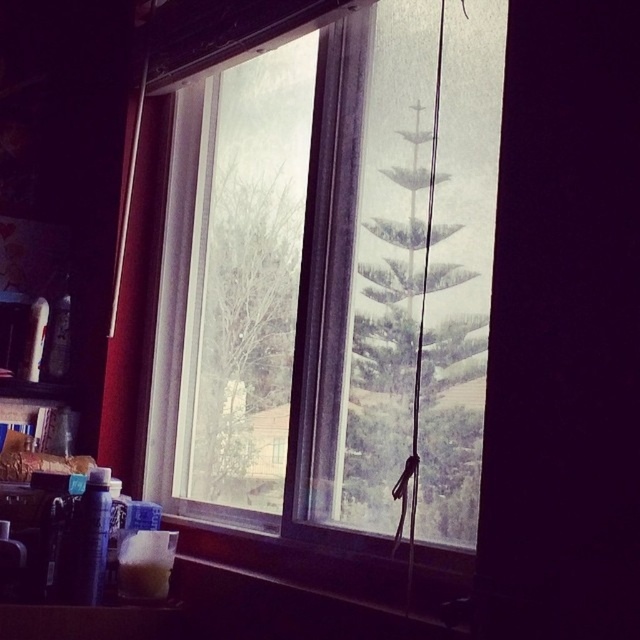
Question: Is green matte tree at center positioned in front of bare branches at center?

Choices:
 (A) yes
 (B) no

Answer: (A)

Question: Considering the relative positions of green matte tree at center and bare branches at center in the image provided, where is green matte tree at center located with respect to bare branches at center?

Choices:
 (A) right
 (B) left

Answer: (A)

Question: Does green matte tree at center have a smaller size compared to bare branches at center?

Choices:
 (A) yes
 (B) no

Answer: (A)

Question: Which object is the closest to the transparent glass window at center?

Choices:
 (A) green matte tree at center
 (B) bare branches at center

Answer: (B)

Question: Which object is positioned farthest from the transparent glass window at center?

Choices:
 (A) green matte tree at center
 (B) bare branches at center

Answer: (A)

Question: Which object is the closest to the transparent glass window at center?

Choices:
 (A) bare branches at center
 (B) green matte tree at center

Answer: (A)